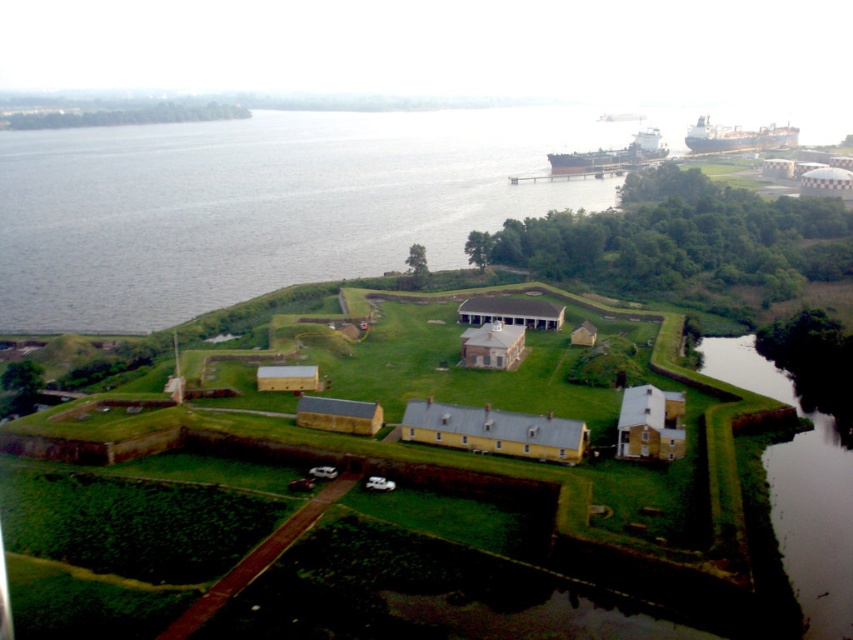
Does metallic gray ship at upper right have a lesser width compared to black matte cargo ship at upper right?

Indeed, metallic gray ship at upper right has a lesser width compared to black matte cargo ship at upper right.

Can you confirm if metallic gray ship at upper right is positioned to the right of black matte cargo ship at upper right?

No, metallic gray ship at upper right is not to the right of black matte cargo ship at upper right.

Does point (660, 132) come farther from viewer compared to point (772, 147)?

No, (660, 132) is closer to viewer.

The width and height of the screenshot is (853, 640). Find the location of `metallic gray ship at upper right`. metallic gray ship at upper right is located at coordinates (610, 156).

Is green grassy embankment at lower right closer to camera compared to metallic gray ship at upper right?

Yes.

Does green grassy embankment at lower right have a larger size compared to metallic gray ship at upper right?

No, green grassy embankment at lower right is not bigger than metallic gray ship at upper right.

Between point (827, 490) and point (590, 168), which one is positioned behind?

The point (590, 168) is behind.

Identify the location of green grassy embankment at lower right. (801, 486).

Can you confirm if gray water at upper left is smaller than black matte cargo ship at upper right?

Incorrect, gray water at upper left is not smaller in size than black matte cargo ship at upper right.

Can you confirm if gray water at upper left is positioned to the right of black matte cargo ship at upper right?

In fact, gray water at upper left is to the left of black matte cargo ship at upper right.

At what (x,y) coordinates should I click in order to perform the action: click on gray water at upper left. Please return your answer as a coordinate pair (x, y). This screenshot has width=853, height=640. Looking at the image, I should click on (262, 204).

The width and height of the screenshot is (853, 640). I want to click on gray water at upper left, so click(x=262, y=204).